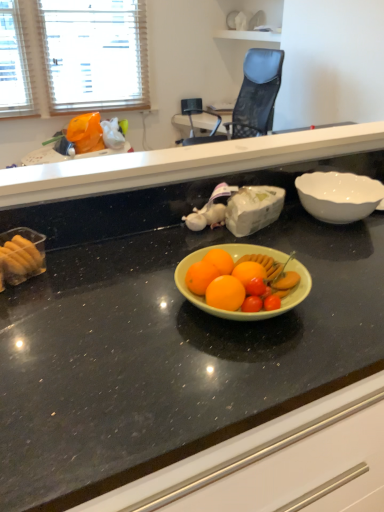
Question: Can you confirm if green matte bowl at center, which is counted as the second countertop, starting from the top, is thinner than blue mesh chair at upper center?

Choices:
 (A) no
 (B) yes

Answer: (B)

Question: Is green matte bowl at center, which is counted as the second countertop, starting from the top, taller than blue mesh chair at upper center?

Choices:
 (A) no
 (B) yes

Answer: (B)

Question: Considering the relative positions of green matte bowl at center, the 1th countertop when ordered from bottom to top, and blue mesh chair at upper center in the image provided, is green matte bowl at center, the 1th countertop when ordered from bottom to top, to the right of blue mesh chair at upper center from the viewer's perspective?

Choices:
 (A) yes
 (B) no

Answer: (A)

Question: Can you confirm if green matte bowl at center, which is counted as the second countertop, starting from the top, is wider than blue mesh chair at upper center?

Choices:
 (A) yes
 (B) no

Answer: (B)

Question: From the image's perspective, is green matte bowl at center, the 1th countertop when ordered from bottom to top, under blue mesh chair at upper center?

Choices:
 (A) no
 (B) yes

Answer: (B)

Question: Is green matte bowl at center, which is counted as the second countertop, starting from the top, oriented away from blue mesh chair at upper center?

Choices:
 (A) yes
 (B) no

Answer: (A)

Question: Is white glossy bowl at right looking in the opposite direction of blue mesh chair at upper center?

Choices:
 (A) no
 (B) yes

Answer: (B)

Question: Can you confirm if white glossy bowl at right is bigger than blue mesh chair at upper center?

Choices:
 (A) yes
 (B) no

Answer: (B)

Question: From a real-world perspective, is white glossy bowl at right on top of blue mesh chair at upper center?

Choices:
 (A) no
 (B) yes

Answer: (B)

Question: Is white glossy bowl at right to the left of blue mesh chair at upper center from the viewer's perspective?

Choices:
 (A) yes
 (B) no

Answer: (B)

Question: Is white glossy bowl at right outside blue mesh chair at upper center?

Choices:
 (A) no
 (B) yes

Answer: (B)

Question: Does white glossy bowl at right touch blue mesh chair at upper center?

Choices:
 (A) yes
 (B) no

Answer: (B)

Question: Could white glossy bowl at right be considered to be inside black granite countertop at center, the 2th countertop when ordered from bottom to top?

Choices:
 (A) yes
 (B) no

Answer: (B)